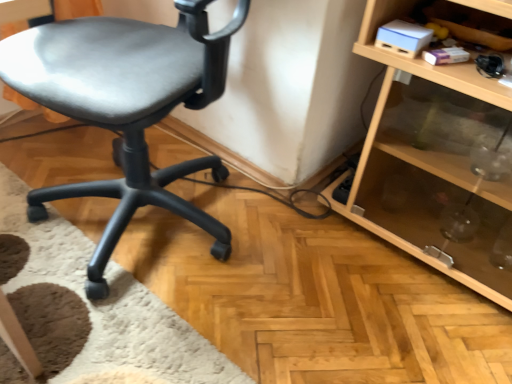
Question: In terms of size, does matte black chair at left appear bigger or smaller than transparent glass shelf at lower right?

Choices:
 (A) big
 (B) small

Answer: (A)

Question: From a real-world perspective, relative to transparent glass shelf at lower right, is matte black chair at left vertically above or below?

Choices:
 (A) below
 (B) above

Answer: (B)

Question: Is matte black chair at left taller or shorter than transparent glass shelf at lower right?

Choices:
 (A) short
 (B) tall

Answer: (B)

Question: Looking at the image, does transparent glass shelf at lower right seem bigger or smaller compared to matte black chair at left?

Choices:
 (A) small
 (B) big

Answer: (A)

Question: From the image's perspective, is transparent glass shelf at lower right above or below matte black chair at left?

Choices:
 (A) below
 (B) above

Answer: (A)

Question: Would you say transparent glass shelf at lower right is inside or outside matte black chair at left?

Choices:
 (A) inside
 (B) outside

Answer: (B)

Question: From a real-world perspective, relative to matte black chair at left, is transparent glass shelf at lower right vertically above or below?

Choices:
 (A) above
 (B) below

Answer: (B)